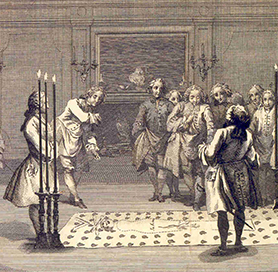
Where is `2 areas of candles on wall`? The image size is (278, 272). 2 areas of candles on wall is located at coordinates (199, 60), (77, 64).